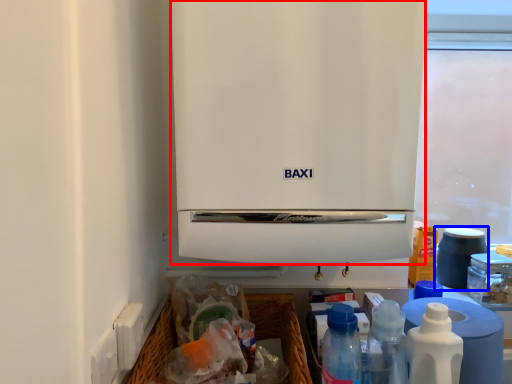
Question: Among these objects, which one is farthest to the camera, home appliance (highlighted by a red box) or appliance (highlighted by a blue box)?

Choices:
 (A) home appliance
 (B) appliance

Answer: (B)